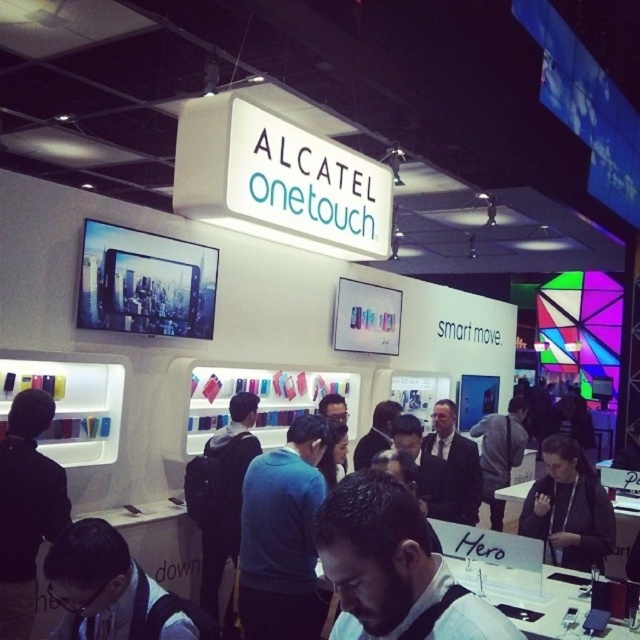
Consider the image. You are a visitor at the exhibition booth and want to check both the black backpack at center and the black fabric jacket at center. Which one do you need to move first to see the other?

The black backpack at center is in front of the black fabric jacket at center, so you need to move the black backpack at center first to see the black fabric jacket at center.

You are at the Alcatel OneTouch exhibition booth and notice a blue sweater at center and a black backpack at center. Which item is wider?

The black backpack at center is wider than the blue sweater at center because the blue sweater at center has a smaller width.